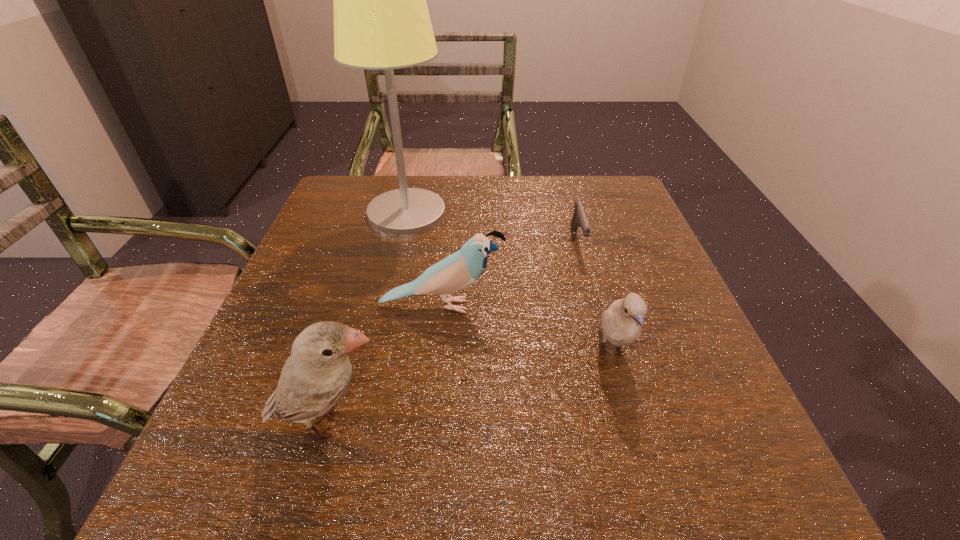
You are a GUI agent. You are given a task and a screenshot of the screen. Output one action in this format:
    pyautogui.click(x=<x>, y=<y>)
    Task: Click on the free space located 0.100m at the beak of the second nearest bird
    This screenshot has height=540, width=960.
    Given the screenshot: What is the action you would take?
    pyautogui.click(x=638, y=448)

Identify the location of vacant area situated 0.200m at the barrel of the pistol. (601, 329).

Where is `object at the far edge`? The image size is (960, 540). object at the far edge is located at coordinates (381, 20).

Where is `object present at the near edge`? The height and width of the screenshot is (540, 960). object present at the near edge is located at coordinates (318, 372).

At what (x,y) coordinates should I click in order to perform the action: click on table lamp at the left edge. Please return your answer as a coordinate pair (x, y). Looking at the image, I should click on (381, 20).

Identify the location of bird situated at the left edge. The height and width of the screenshot is (540, 960). (318, 372).

Find the location of a particular element. object located at the right edge is located at coordinates (621, 324).

Identify the location of object situated at the far left corner. The height and width of the screenshot is (540, 960). (381, 20).

You are a GUI agent. You are given a task and a screenshot of the screen. Output one action in this format:
    pyautogui.click(x=<x>, y=<y>)
    Task: Click on the object present at the near left corner
    
    Given the screenshot: What is the action you would take?
    pyautogui.click(x=318, y=372)

Image resolution: width=960 pixels, height=540 pixels. In the image, there is a desktop. In order to click on free space at the far edge in this screenshot , I will do `click(542, 194)`.